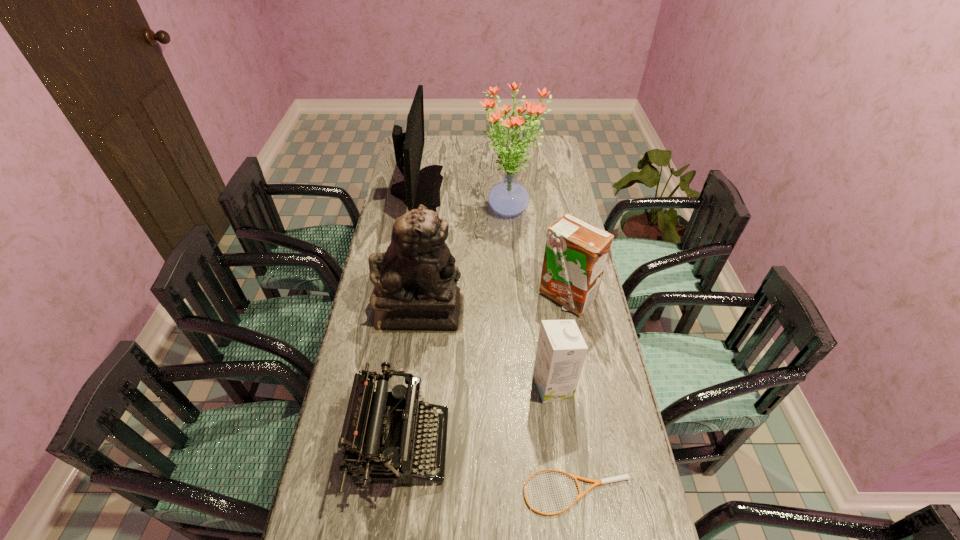
Locate an element on the screen. Image resolution: width=960 pixels, height=540 pixels. free region located 0.290m on the straw side of the farther carton is located at coordinates (585, 398).

The width and height of the screenshot is (960, 540). I want to click on vacant region located 0.060m on the front of the nearer carton, so click(558, 424).

The height and width of the screenshot is (540, 960). I want to click on vacant space located on the keyboard of the typewriter, so click(554, 446).

Image resolution: width=960 pixels, height=540 pixels. What are the coordinates of `vacant space located on the back of the tennis racket` in the screenshot? It's located at (561, 380).

Locate an element on the screen. object that is at the far edge is located at coordinates (423, 186).

You are a GUI agent. You are given a task and a screenshot of the screen. Output one action in this format:
    pyautogui.click(x=<x>, y=<y>)
    Task: Click on the sculpture located in the left edge section of the desktop
    This screenshot has height=540, width=960.
    Given the screenshot: What is the action you would take?
    pyautogui.click(x=415, y=281)

Find the location of a particular element. monitor located at the left edge is located at coordinates (423, 186).

Find the location of a particular element. The width and height of the screenshot is (960, 540). typewriter present at the left edge is located at coordinates tap(395, 414).

The width and height of the screenshot is (960, 540). What are the coordinates of `flower arrangement that is at the right edge` in the screenshot? It's located at (508, 198).

Locate an element on the screen. The width and height of the screenshot is (960, 540). tennis racket that is at the right edge is located at coordinates (621, 477).